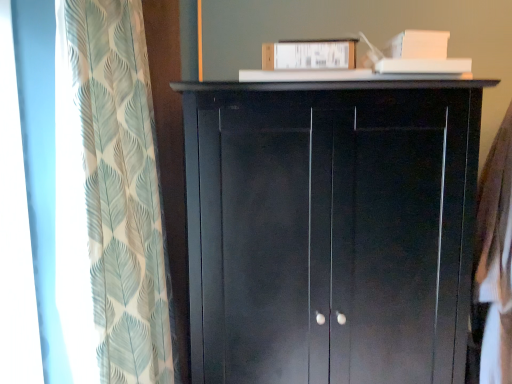
Question: Does white cotton shirt at right have a greater width compared to matte black cupboard at center?

Choices:
 (A) no
 (B) yes

Answer: (A)

Question: Is white cotton shirt at right touching matte black cupboard at center?

Choices:
 (A) yes
 (B) no

Answer: (B)

Question: From a real-world perspective, is white cotton shirt at right physically below matte black cupboard at center?

Choices:
 (A) no
 (B) yes

Answer: (B)

Question: From a real-world perspective, is white cotton shirt at right on matte black cupboard at center?

Choices:
 (A) no
 (B) yes

Answer: (A)

Question: Is white cotton shirt at right further to camera compared to matte black cupboard at center?

Choices:
 (A) no
 (B) yes

Answer: (B)

Question: Is translucent leaf-patterned curtain at left in front of or behind white cotton shirt at right in the image?

Choices:
 (A) front
 (B) behind

Answer: (A)

Question: Looking at the image, does translucent leaf-patterned curtain at left seem bigger or smaller compared to white cotton shirt at right?

Choices:
 (A) big
 (B) small

Answer: (A)

Question: Would you say translucent leaf-patterned curtain at left is inside or outside white cotton shirt at right?

Choices:
 (A) outside
 (B) inside

Answer: (A)

Question: Is translucent leaf-patterned curtain at left taller or shorter than white cotton shirt at right?

Choices:
 (A) short
 (B) tall

Answer: (B)

Question: From their relative heights in the image, would you say matte black cupboard at center is taller or shorter than white cotton shirt at right?

Choices:
 (A) short
 (B) tall

Answer: (B)

Question: In terms of width, does matte black cupboard at center look wider or thinner when compared to white cotton shirt at right?

Choices:
 (A) thin
 (B) wide

Answer: (B)

Question: Considering their positions, is matte black cupboard at center located in front of or behind white cotton shirt at right?

Choices:
 (A) behind
 (B) front

Answer: (B)

Question: Is matte black cupboard at center to the left or to the right of white cotton shirt at right in the image?

Choices:
 (A) left
 (B) right

Answer: (A)

Question: In terms of width, does translucent leaf-patterned curtain at left look wider or thinner when compared to matte black cupboard at center?

Choices:
 (A) thin
 (B) wide

Answer: (A)

Question: Looking at the image, does translucent leaf-patterned curtain at left seem bigger or smaller compared to matte black cupboard at center?

Choices:
 (A) big
 (B) small

Answer: (B)